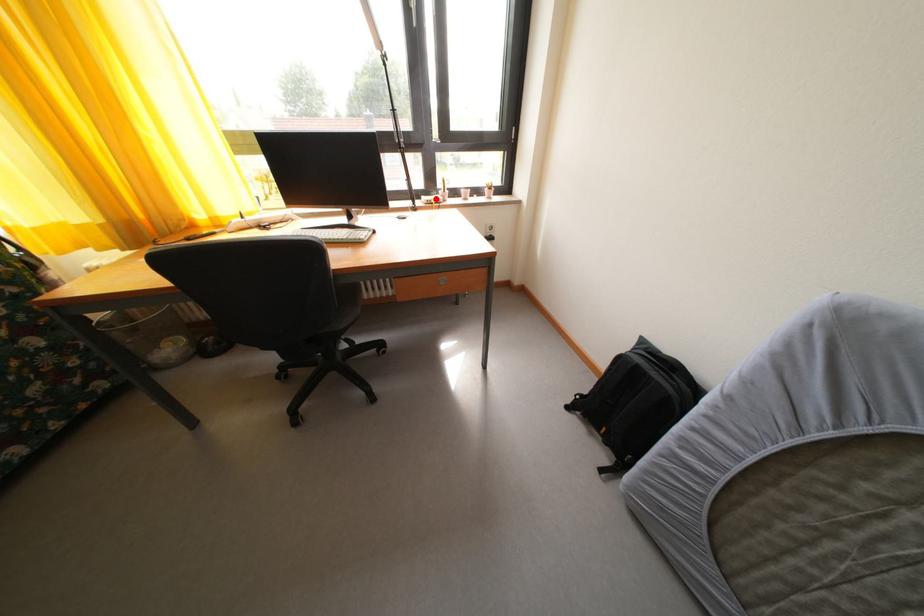
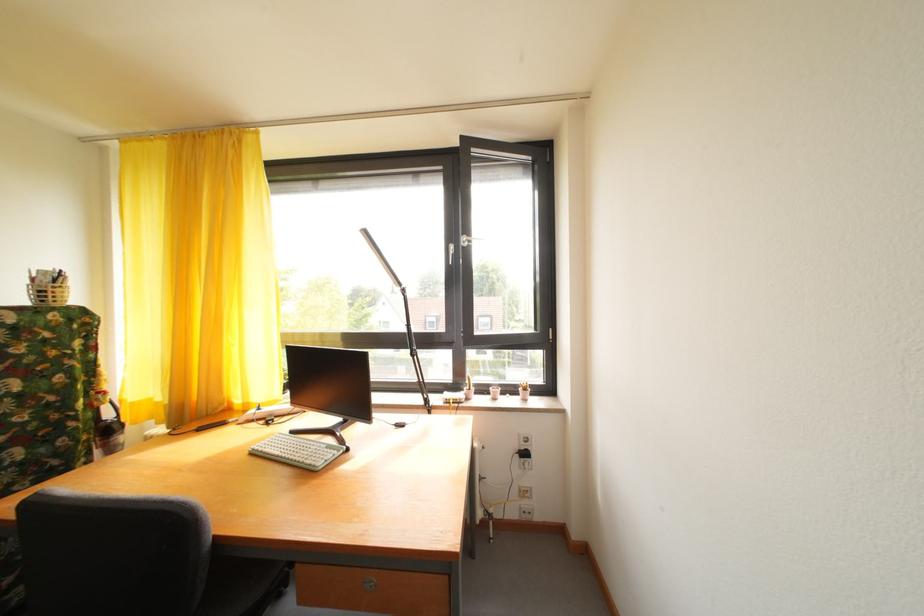
Find the pixel in the second image that matches the highlighted location in the first image.

(464, 392)